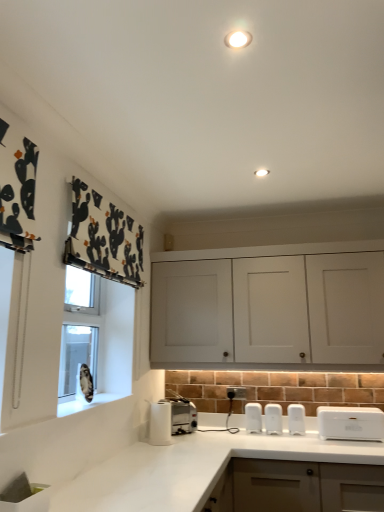
Question: Should I look upward or downward to see white marble countertop at lower center?

Choices:
 (A) up
 (B) down

Answer: (B)

Question: Is white marble countertop at lower center oriented away from white matte cabinet at center?

Choices:
 (A) yes
 (B) no

Answer: (B)

Question: Is white marble countertop at lower center facing towards white matte cabinet at center?

Choices:
 (A) no
 (B) yes

Answer: (A)

Question: Is there a large distance between white marble countertop at lower center and white matte cabinet at center?

Choices:
 (A) yes
 (B) no

Answer: (B)

Question: Does white marble countertop at lower center have a lesser height compared to white matte cabinet at center?

Choices:
 (A) yes
 (B) no

Answer: (B)

Question: From the image's perspective, is white marble countertop at lower center over white matte cabinet at center?

Choices:
 (A) no
 (B) yes

Answer: (A)

Question: From a real-world perspective, is white marble countertop at lower center on white matte cabinet at center?

Choices:
 (A) no
 (B) yes

Answer: (A)

Question: Does white matte cabinet at center have a lesser width compared to white marble countertop at lower center?

Choices:
 (A) yes
 (B) no

Answer: (A)

Question: Is white marble countertop at lower center at the back of white matte cabinet at center?

Choices:
 (A) no
 (B) yes

Answer: (A)

Question: Is white matte cabinet at center positioned behind white marble countertop at lower center?

Choices:
 (A) yes
 (B) no

Answer: (A)

Question: Could you tell me if white matte cabinet at center is facing white marble countertop at lower center?

Choices:
 (A) yes
 (B) no

Answer: (B)

Question: From a real-world perspective, is white matte cabinet at center beneath white marble countertop at lower center?

Choices:
 (A) yes
 (B) no

Answer: (B)

Question: Is white matte cabinet at center at the right side of white marble countertop at lower center?

Choices:
 (A) yes
 (B) no

Answer: (A)

Question: Would you say white matte cabinet at center is inside or outside white marble countertop at lower center?

Choices:
 (A) inside
 (B) outside

Answer: (B)